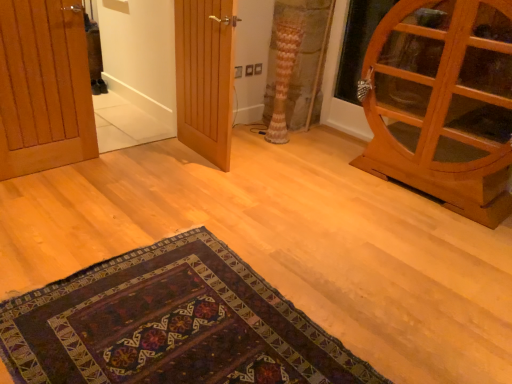
Locate an element on the screen. Image resolution: width=512 pixels, height=384 pixels. vacant region to the right of dark woven rug at lower center is located at coordinates (411, 297).